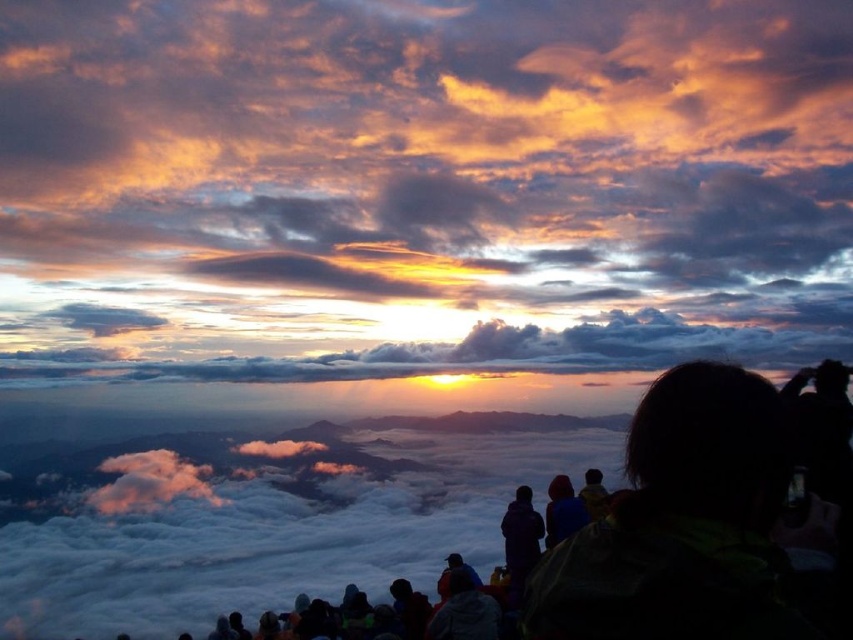
Question: Which point is farther from the camera taking this photo?

Choices:
 (A) (457, 68)
 (B) (601, 484)
 (C) (502, 518)
 (D) (582, 522)

Answer: (A)

Question: Which of these objects is positioned closest to the matte purple jacket at center?

Choices:
 (A) dark blue jacket at center
 (B) cloudy sky at upper center

Answer: (A)

Question: Does cloudy sky at upper center have a greater width compared to matte purple jacket at center?

Choices:
 (A) no
 (B) yes

Answer: (B)

Question: Which point is farther from the camera taking this photo?

Choices:
 (A) (544, 529)
 (B) (520, 502)
 (C) (596, 504)

Answer: (A)

Question: Is blue fabric jacket at center positioned before dark blue jacket at center?

Choices:
 (A) no
 (B) yes

Answer: (A)

Question: Does cloudy sky at upper center appear under matte purple jacket at center?

Choices:
 (A) no
 (B) yes

Answer: (A)